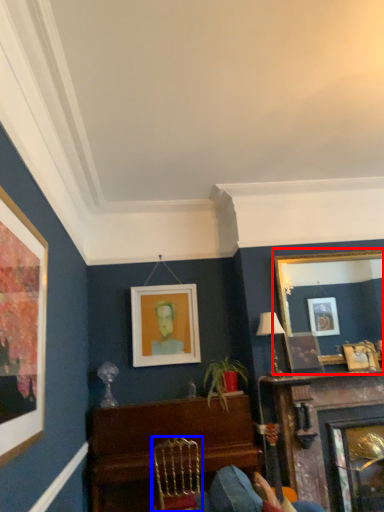
Question: Which object is closer to the camera taking this photo, picture frame (highlighted by a red box) or chair (highlighted by a blue box)?

Choices:
 (A) picture frame
 (B) chair

Answer: (B)